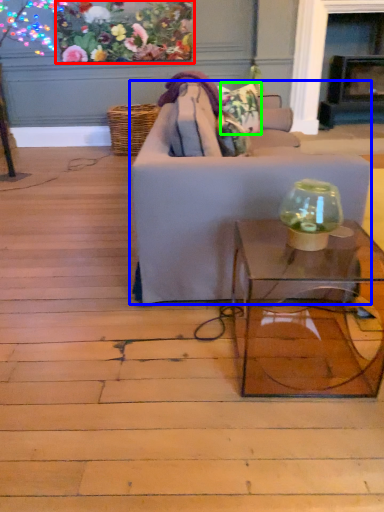
Question: Which is farther away from floral arrangement (highlighted by a red box)? studio couch (highlighted by a blue box) or flower (highlighted by a green box)?

Choices:
 (A) studio couch
 (B) flower

Answer: (A)